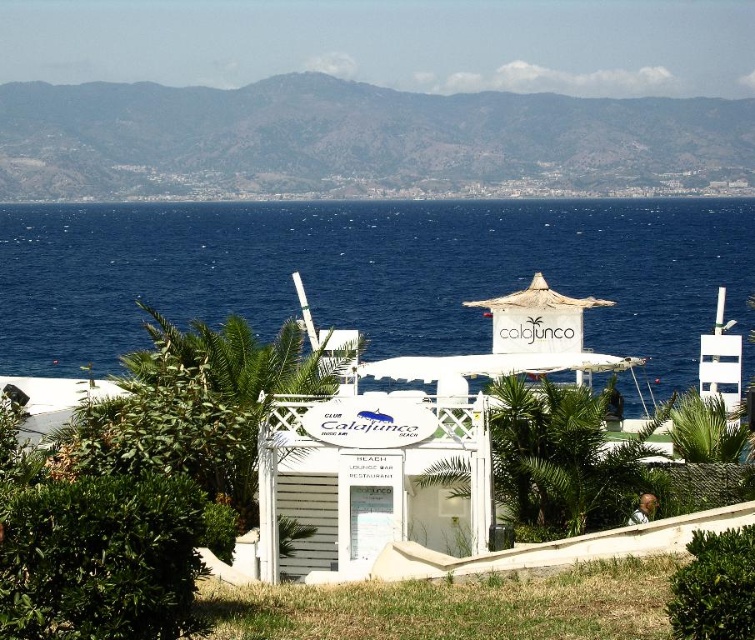
You are planning to build a path from the Club Calajunco to the blue water at center. Considering the green grassy hillside at upper center is in the way, which direction should the path go around it?

The path should go around the green grassy hillside at upper center to the left or right since the blue water at center is located below the hillside and cannot be reached directly through it.

You are standing in front of Club Calajunco and want to take a photo that includes both the blue water at center and the green grassy hillside at upper center. Which object will appear larger in the photo?

The blue water at center will appear larger in the photo because it is closer to the viewer than the green grassy hillside at upper center.

You are standing at the entrance of Club Calajunco and want to walk directly to the blue water at center. According to the coordinates provided, in which direction should you head relative to your current position?

The blue water at center is located at coordinates point (370, 273). Since you are at the entrance of Club Calajunco, which is in the foreground, you should head forward towards the center of the image to reach the blue water at center.